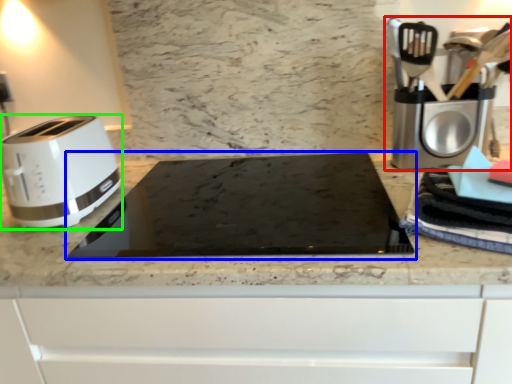
Question: Estimate the real-world distances between objects in this image. Which object is closer to coffee machine (highlighted by a red box), home appliance (highlighted by a blue box) or toaster (highlighted by a green box)?

Choices:
 (A) home appliance
 (B) toaster

Answer: (A)